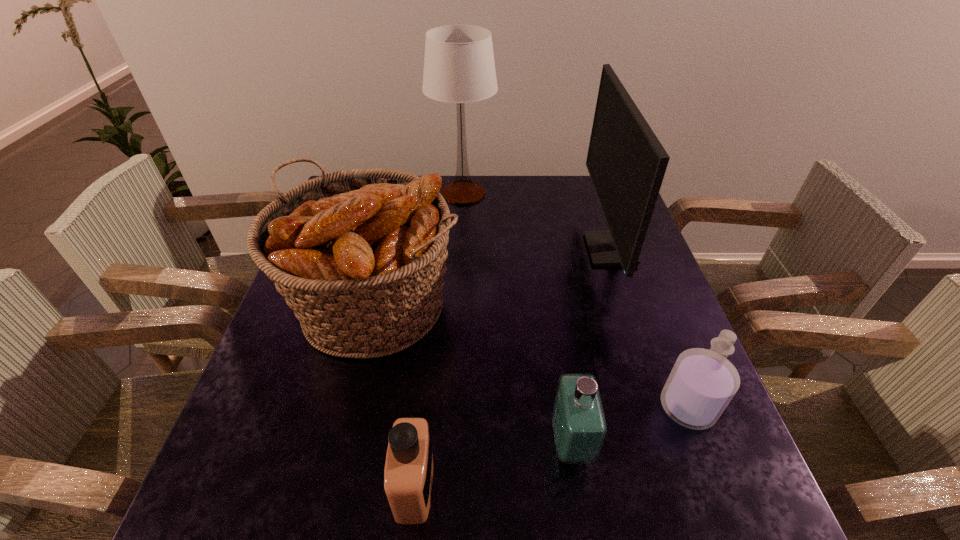
Find the location of `free spot located on the front of the fourth shortest object`. free spot located on the front of the fourth shortest object is located at coordinates (334, 486).

I want to click on vacant space situated 0.100m on the front of the rightmost perfume, so click(718, 488).

At what (x,y) coordinates should I click in order to perform the action: click on free space located 0.110m on the front label of the third object from right to left. Please return your answer as a coordinate pair (x, y). Image resolution: width=960 pixels, height=540 pixels. Looking at the image, I should click on (492, 443).

The height and width of the screenshot is (540, 960). I want to click on vacant space located on the front label of the third object from right to left, so click(454, 443).

Image resolution: width=960 pixels, height=540 pixels. In order to click on vacant space positioned on the front label of the third object from right to left in this screenshot , I will do `click(492, 443)`.

This screenshot has height=540, width=960. I want to click on free space located on the front label of the leftmost perfume, so click(x=543, y=485).

This screenshot has width=960, height=540. I want to click on table lamp present at the far edge, so click(x=459, y=67).

This screenshot has width=960, height=540. In order to click on computer monitor located at the far edge in this screenshot , I will do `click(626, 162)`.

Locate an element on the screen. Image resolution: width=960 pixels, height=540 pixels. object located at the near edge is located at coordinates (408, 475).

In order to click on object present at the left edge in this screenshot , I will do `click(360, 255)`.